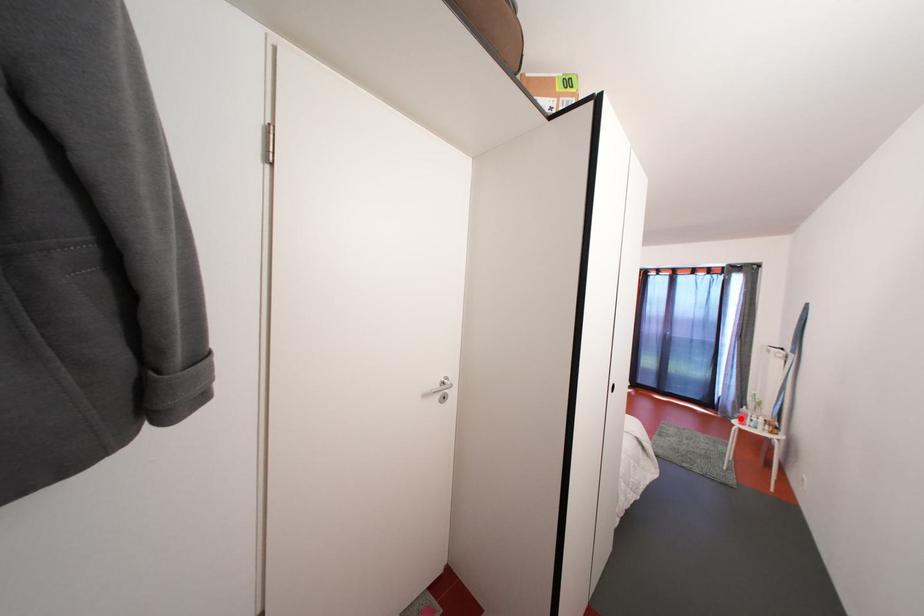
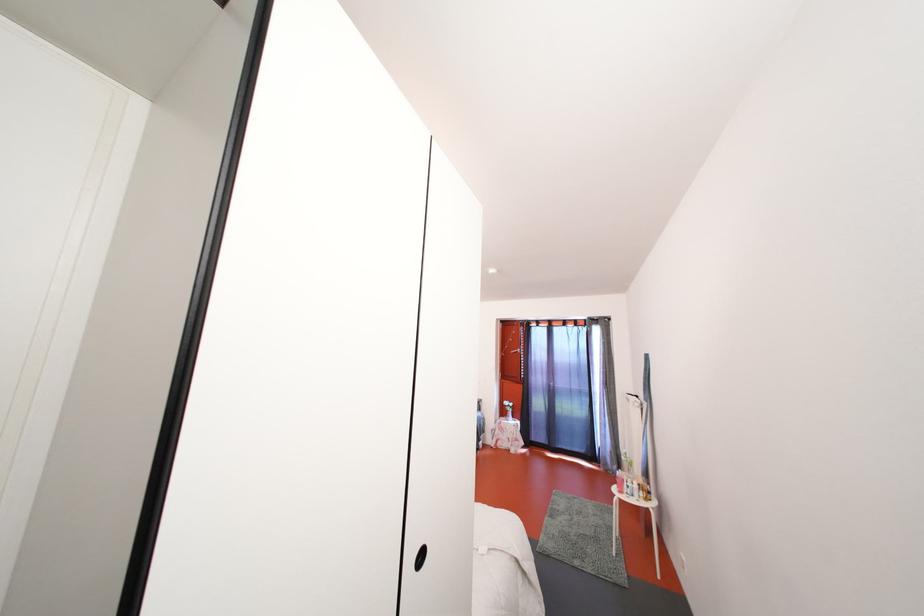
Locate, in the second image, the point that corresponds to the highlighted location in the first image.

(619, 469)